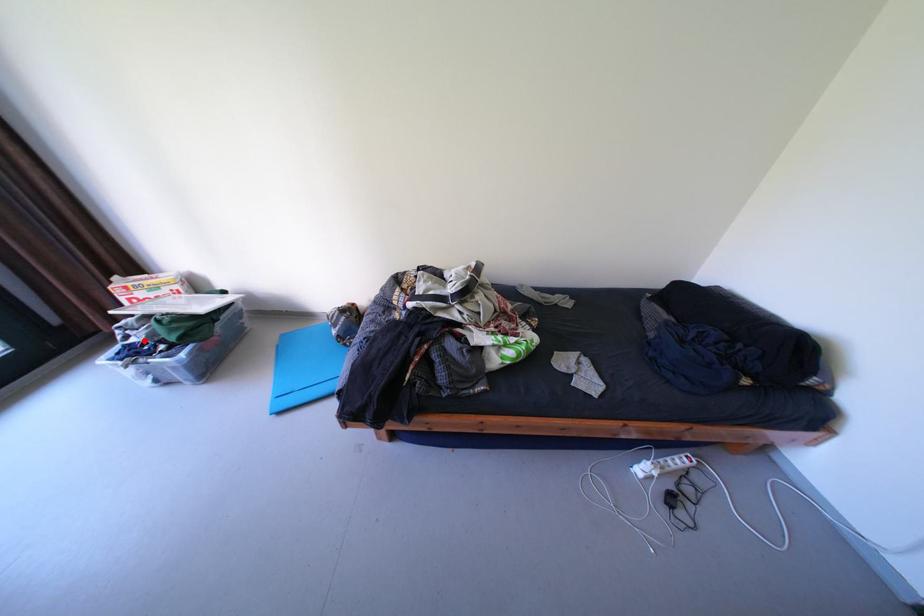
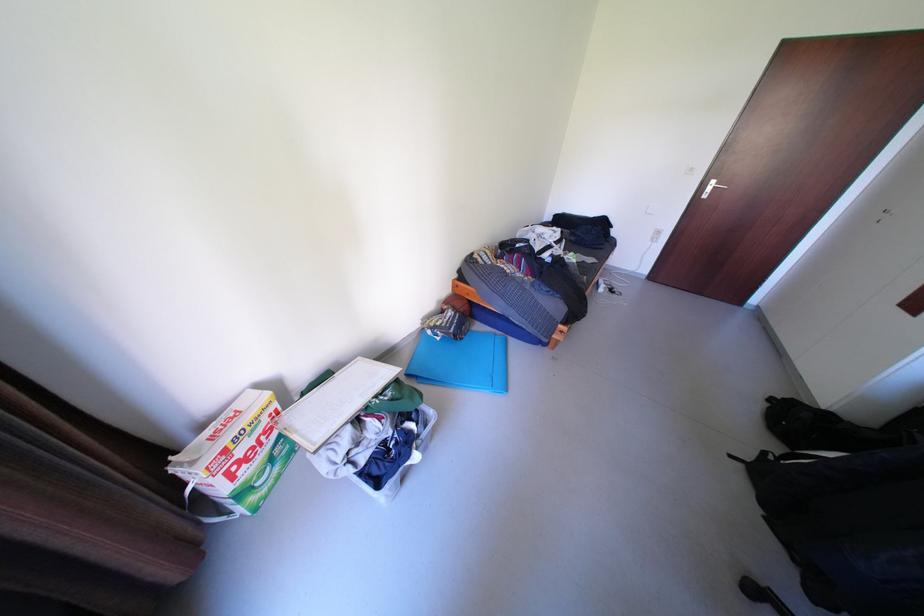
Question: I am providing you with two images of the same scene from different viewpoints. Given a red point in image1, look at the same physical point in image2. Is it:

Choices:
 (A) Closer to the viewpoint
 (B) Farther from the viewpoint

Answer: (B)